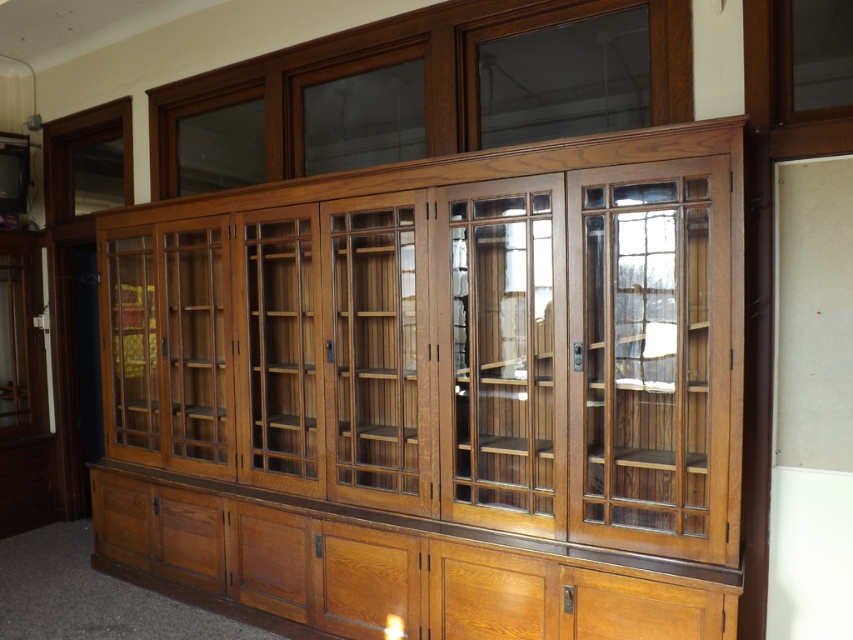
Between clear glass cabinet at center and clear wood glass door at center, which one appears on the right side from the viewer's perspective?

clear wood glass door at center

What do you see at coordinates (502, 355) in the screenshot? I see `clear glass cabinet at center` at bounding box center [502, 355].

Is point (554, 429) closer to viewer compared to point (601, 218)?

Yes.

At what (x,y) coordinates should I click in order to perform the action: click on clear glass cabinet at center. Please return your answer as a coordinate pair (x, y). Looking at the image, I should click on coord(502,355).